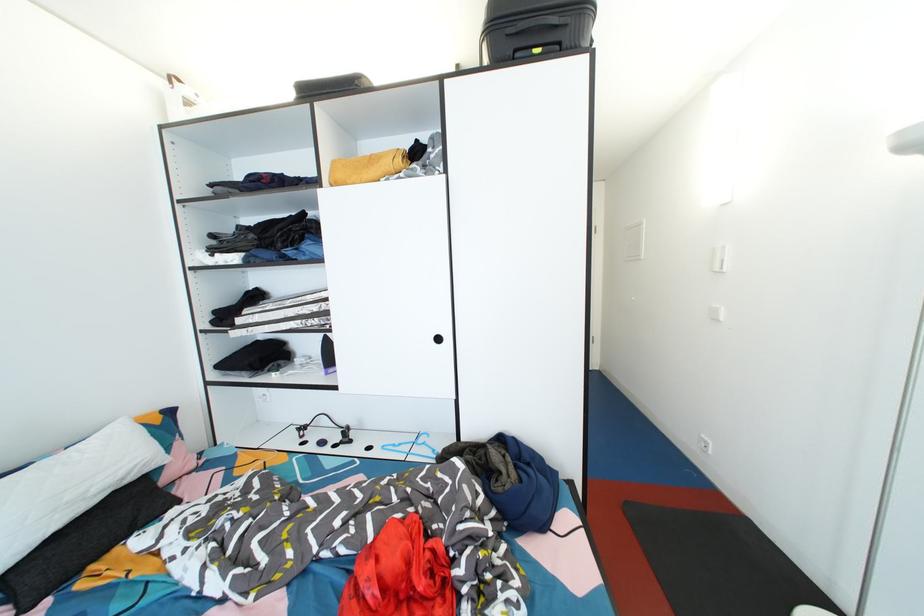
Identify the location of blue plastic hanger. (415, 448).